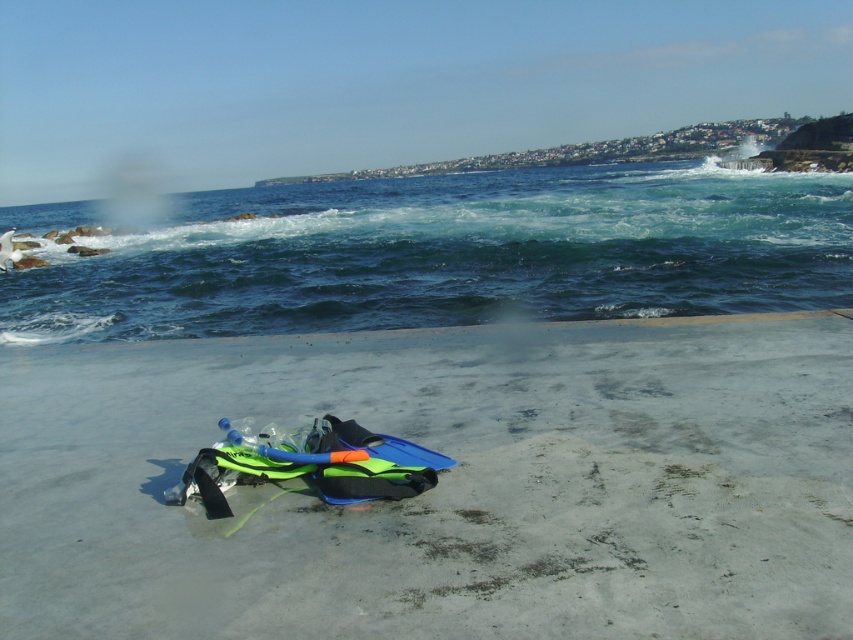
Which is more to the left, gray concrete at center or greenish-blue water at upper center?

greenish-blue water at upper center is more to the left.

Does gray concrete at center have a greater width compared to greenish-blue water at upper center?

In fact, gray concrete at center might be narrower than greenish-blue water at upper center.

Between point (306, 506) and point (358, 220), which one is positioned behind?

The point (358, 220) is behind.

At what (x,y) coordinates should I click in order to perform the action: click on gray concrete at center. Please return your answer as a coordinate pair (x, y). Looking at the image, I should click on (444, 484).